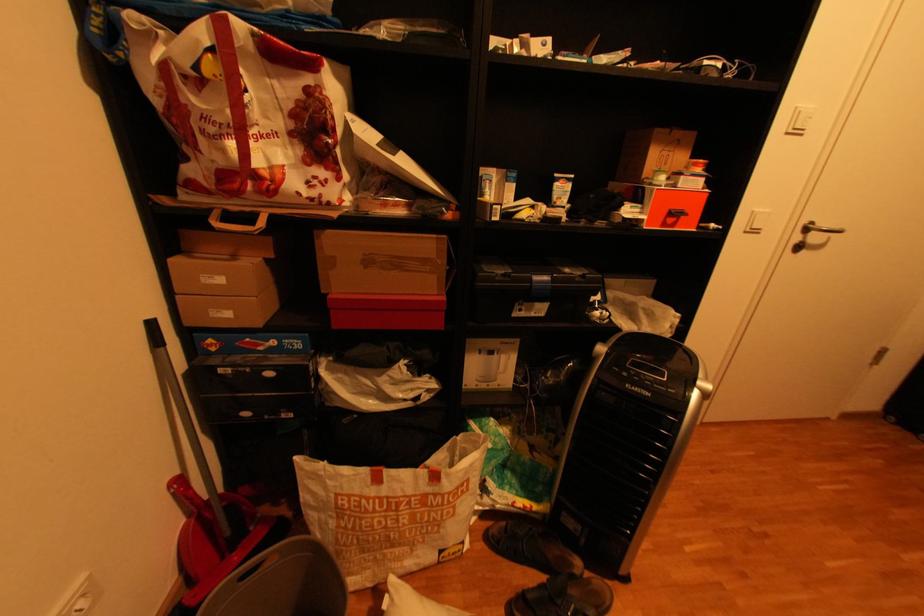
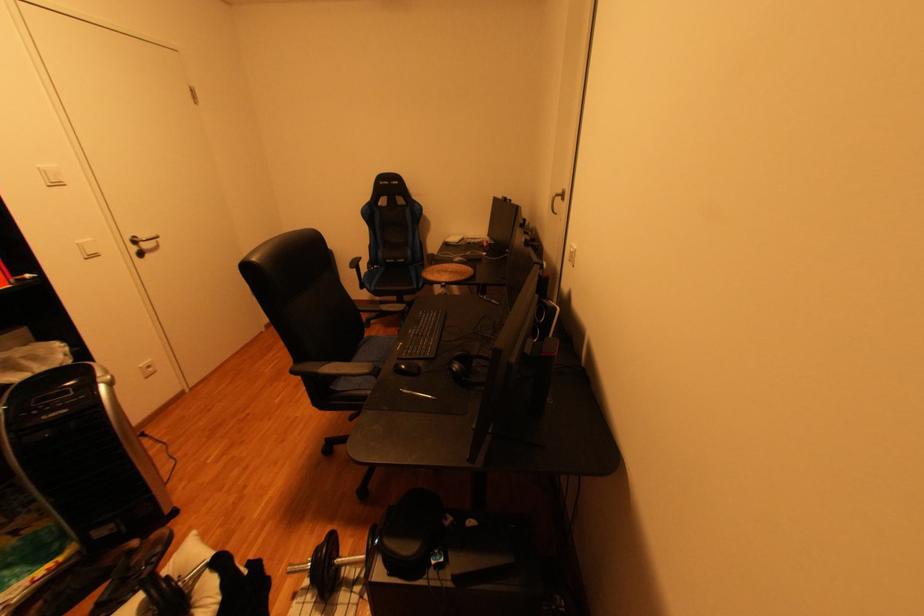
In the second image, find the point that corresponds to the point at 815,238 in the first image.

(150, 248)